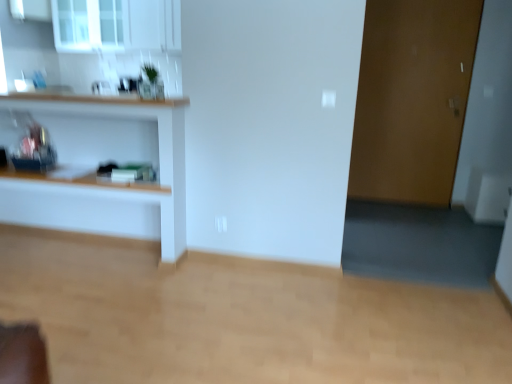
Question: Considering the relative sizes of transparent glass window at upper left and brown matte door at right in the image provided, is transparent glass window at upper left thinner than brown matte door at right?

Choices:
 (A) yes
 (B) no

Answer: (B)

Question: From the image's perspective, is transparent glass window at upper left under brown matte door at right?

Choices:
 (A) no
 (B) yes

Answer: (A)

Question: Could you tell me if transparent glass window at upper left is facing brown matte door at right?

Choices:
 (A) yes
 (B) no

Answer: (B)

Question: Does transparent glass window at upper left come behind brown matte door at right?

Choices:
 (A) yes
 (B) no

Answer: (A)

Question: Is transparent glass window at upper left positioned before brown matte door at right?

Choices:
 (A) no
 (B) yes

Answer: (A)

Question: Is transparent glass window at upper left bigger than brown matte door at right?

Choices:
 (A) yes
 (B) no

Answer: (A)

Question: Is wooden shelf at left thinner than brown matte door at right?

Choices:
 (A) no
 (B) yes

Answer: (A)

Question: Is wooden shelf at left at the left side of brown matte door at right?

Choices:
 (A) yes
 (B) no

Answer: (A)

Question: Does wooden shelf at left have a greater height compared to brown matte door at right?

Choices:
 (A) yes
 (B) no

Answer: (B)

Question: Is wooden shelf at left positioned with its back to brown matte door at right?

Choices:
 (A) no
 (B) yes

Answer: (A)

Question: Is wooden shelf at left next to brown matte door at right and touching it?

Choices:
 (A) yes
 (B) no

Answer: (B)

Question: Is wooden shelf at left shorter than brown matte door at right?

Choices:
 (A) yes
 (B) no

Answer: (A)

Question: From the image's perspective, is transparent glass window at upper left above wooden shelf at left?

Choices:
 (A) yes
 (B) no

Answer: (A)